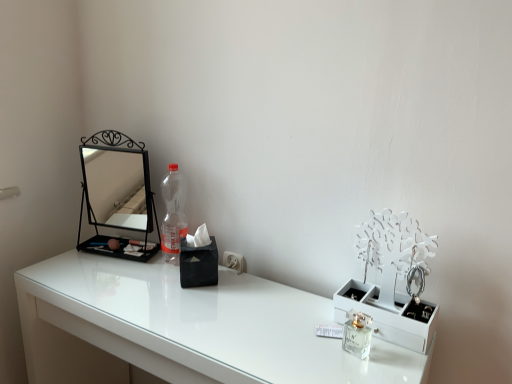
Where is `space that is in front of black metal mirror at left`? space that is in front of black metal mirror at left is located at coordinates (96, 277).